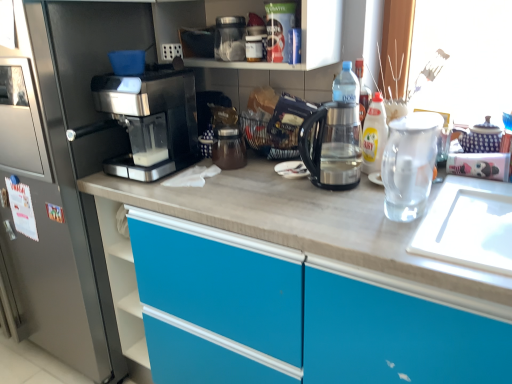
Question: From the image's perspective, is sleek black coffee machine at left above or below transparent plastic kettle at center?

Choices:
 (A) below
 (B) above

Answer: (A)

Question: In terms of width, does sleek black coffee machine at left look wider or thinner when compared to transparent plastic kettle at center?

Choices:
 (A) wide
 (B) thin

Answer: (A)

Question: Which of these objects is positioned farthest from the yellow glossy bottle at upper right?

Choices:
 (A) transparent plastic kettle at center
 (B) transparent plastic container at upper center
 (C) transparent glass tea pot at right
 (D) sleek metallic coffee maker at left
 (E) sleek black coffee machine at left

Answer: (E)

Question: Estimate the real-world distances between objects in this image. Which object is closer to the transparent plastic kettle at center?

Choices:
 (A) sleek metallic coffee maker at left
 (B) transparent plastic container at upper center
 (C) sleek black coffee machine at left
 (D) yellow glossy bottle at upper right
 (E) transparent glass tea pot at right

Answer: (D)